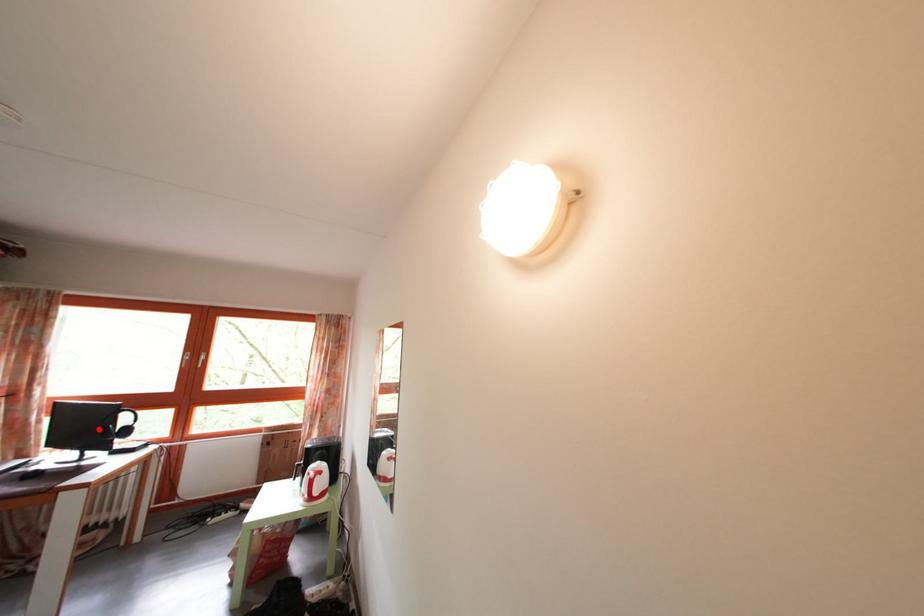
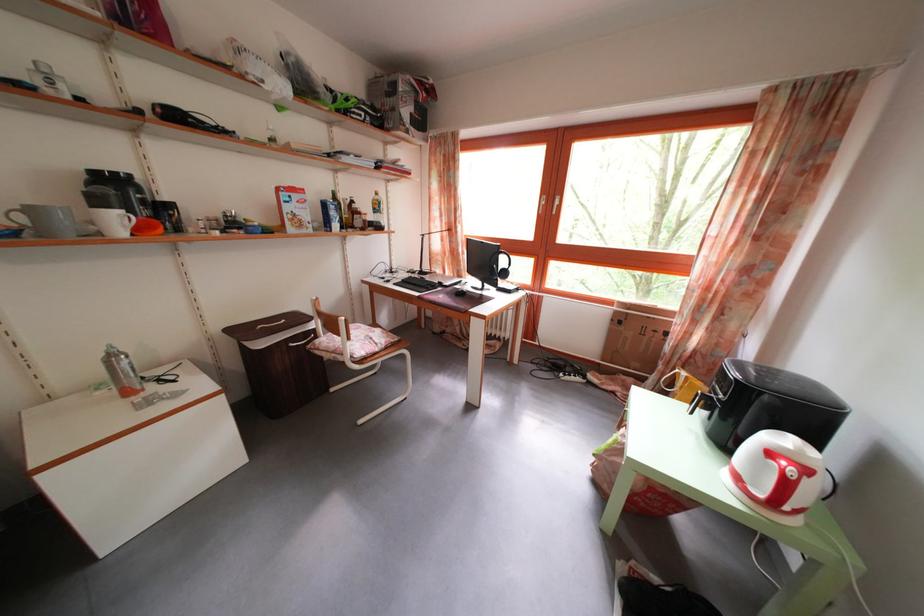
Find the pixel in the second image that matches the highlighted location in the first image.

(492, 265)